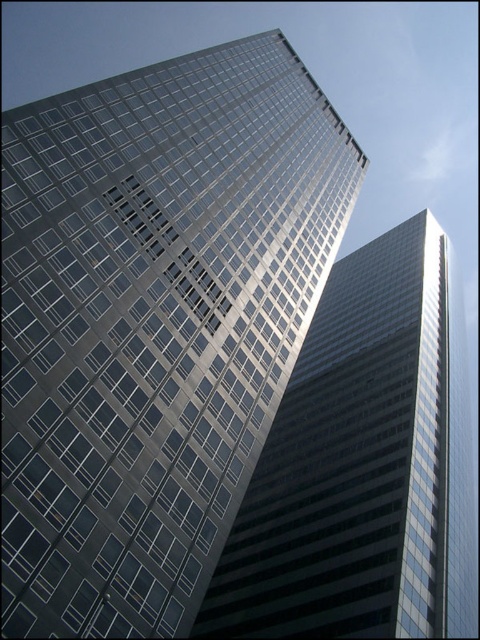
You are an architect reviewing a city model. You notice two buildings in the center of the model, the glossy glass building at center and the reflective glass skyscraper at center. Which of these two buildings appears smaller in the model?

The glossy glass building at center occupies less space than the reflective glass skyscraper at center, so it appears smaller in the model.

You are standing in front of two glass buildings in the city. You see the glossy glass building at center and the reflective glass skyscraper at center. Which one appears nearer to you?

The glossy glass building at center appears nearer to you because it is closer to the viewer than the reflective glass skyscraper at center.

You are a city planner assessing the skyline. You need to determine which of the two buildings, the glossy glass building at center or the reflective glass skyscraper at center, would cast a longer shadow during midday. Based on their positions and the scene description, which one would it be?

The glossy glass building at center has a greater height compared to the reflective glass skyscraper at center. Since taller buildings cast longer shadows, the glossy glass building at center would cast a longer shadow during midday.